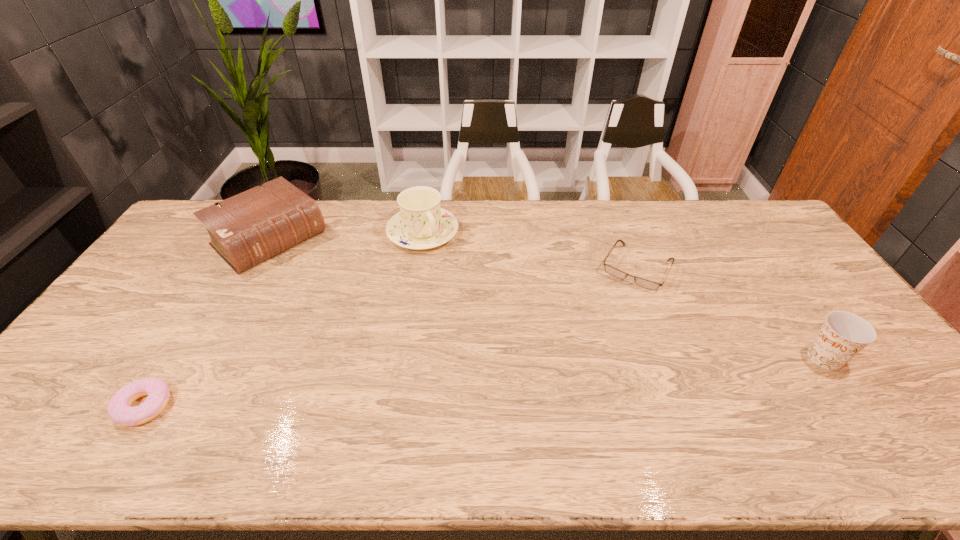
Find the location of a particular element. This screenshot has width=960, height=540. free space that is in between the fourth farthest object and the second object from right to left is located at coordinates (731, 313).

I want to click on unoccupied position between the fourth farthest object and the chinaware, so click(x=624, y=295).

Image resolution: width=960 pixels, height=540 pixels. What are the coordinates of `vacant point located between the spectacles and the Dixie cup` in the screenshot? It's located at (731, 313).

I want to click on empty space between the Dixie cup and the doughnut, so click(x=485, y=382).

The width and height of the screenshot is (960, 540). I want to click on free space between the rightmost object and the nearest object, so click(485, 382).

Find the location of `object that stands as the third closest to the nearest object`. object that stands as the third closest to the nearest object is located at coordinates (647, 284).

Select which object appears as the closest to the spectacles. Please provide its 2D coordinates. Your answer should be formatted as a tuple, i.e. [(x, y)], where the tuple contains the x and y coordinates of a point satisfying the conditions above.

[(843, 335)]

The width and height of the screenshot is (960, 540). In order to click on vacant space that satisfies the following two spatial constraints: 1. on the front side of the chinaware; 2. on the left side of the Dixie cup in this screenshot , I will do `click(403, 358)`.

At what (x,y) coordinates should I click in order to perform the action: click on free space that satisfies the following two spatial constraints: 1. on the front side of the Bible; 2. on the left side of the Dixie cup. Please return your answer as a coordinate pair (x, y). Looking at the image, I should click on (202, 358).